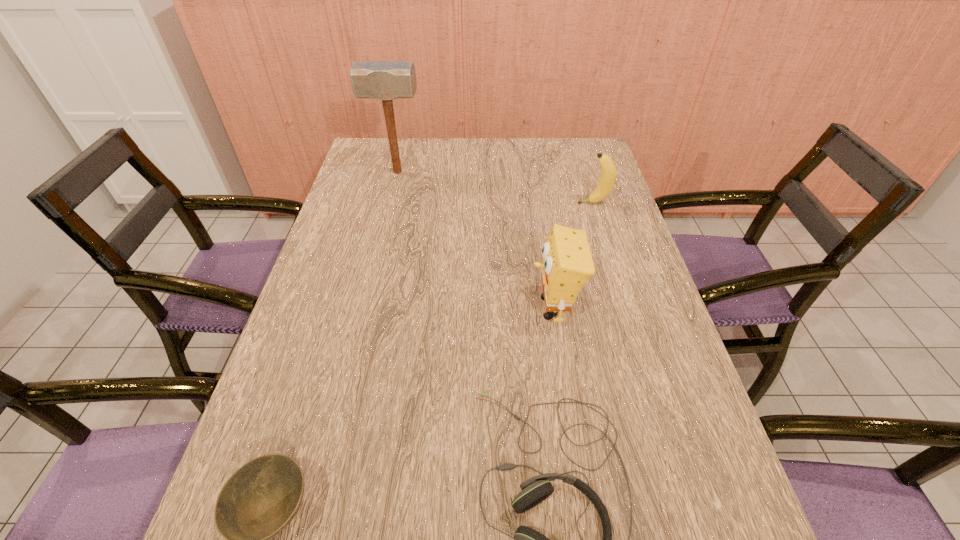
Image resolution: width=960 pixels, height=540 pixels. In order to click on vacant space located 0.180m from the stem of the third tallest object in this screenshot , I will do `click(520, 203)`.

The height and width of the screenshot is (540, 960). Find the location of `vacant space situated 0.310m from the stem of the third tallest object`. vacant space situated 0.310m from the stem of the third tallest object is located at coordinates (479, 203).

Where is `vacant space located 0.250m from the stem of the third tallest object`? This screenshot has width=960, height=540. vacant space located 0.250m from the stem of the third tallest object is located at coordinates (498, 203).

You are a GUI agent. You are given a task and a screenshot of the screen. Output one action in this format:
    pyautogui.click(x=<x>, y=<y>)
    Task: Click on the object located at the far edge
    
    Given the screenshot: What is the action you would take?
    pyautogui.click(x=385, y=80)

Where is `object at the left edge`? The height and width of the screenshot is (540, 960). object at the left edge is located at coordinates (385, 80).

Locate an element on the screen. Image resolution: width=960 pixels, height=540 pixels. object located in the right edge section of the desktop is located at coordinates (608, 169).

Locate an element on the screen. The height and width of the screenshot is (540, 960). object at the far left corner is located at coordinates (385, 80).

The width and height of the screenshot is (960, 540). What are the coordinates of `vacant space at the far edge of the desktop` in the screenshot? It's located at (522, 159).

Where is `free location at the left edge of the desktop`? free location at the left edge of the desktop is located at coordinates click(x=351, y=195).

In the image, there is a desktop. Where is `free space at the right edge`? free space at the right edge is located at coordinates (611, 221).